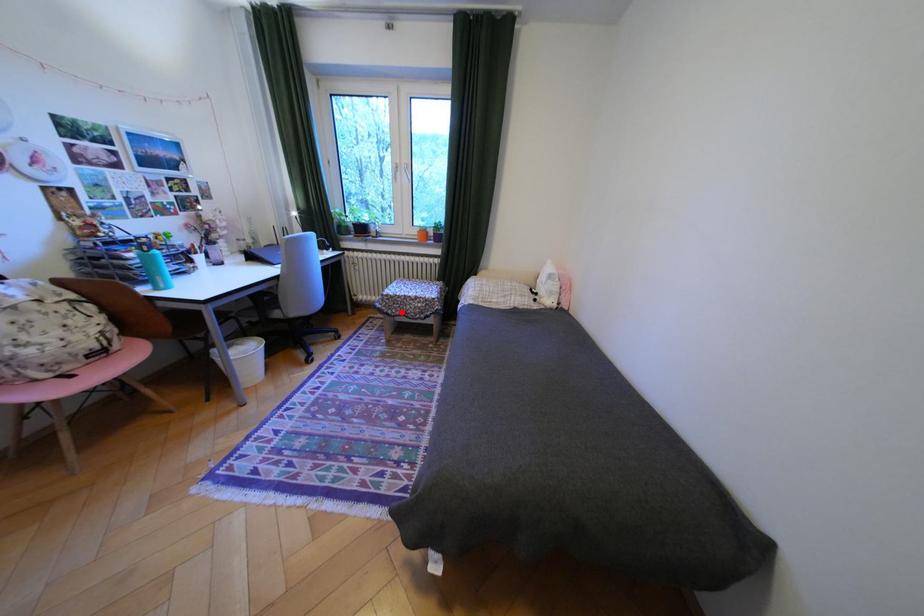
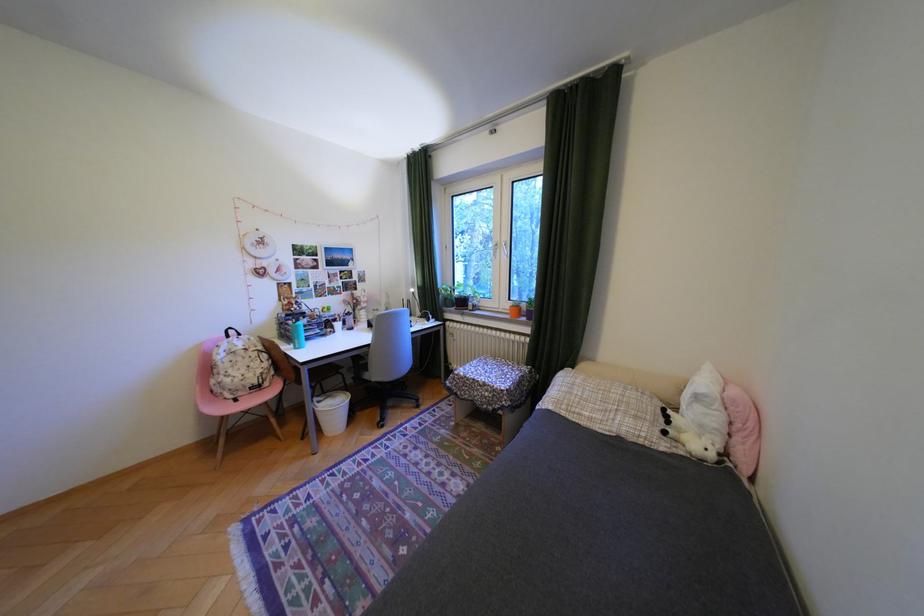
The point at the highlighted location is marked in the first image. Where is the corresponding point in the second image?

(470, 392)